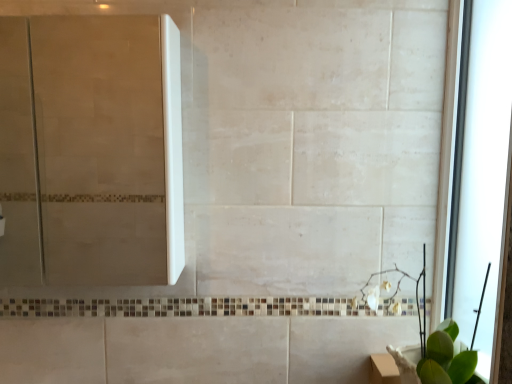
Question: From a real-world perspective, is green leafy plant at lower right positioned under transparent glass window at right based on gravity?

Choices:
 (A) no
 (B) yes

Answer: (B)

Question: Is the position of green leafy plant at lower right more distant than that of transparent glass window at right?

Choices:
 (A) yes
 (B) no

Answer: (B)

Question: Is green leafy plant at lower right not within transparent glass window at right?

Choices:
 (A) no
 (B) yes

Answer: (B)

Question: Can you confirm if green leafy plant at lower right is smaller than transparent glass window at right?

Choices:
 (A) no
 (B) yes

Answer: (A)

Question: Could transparent glass window at right be considered to be inside green leafy plant at lower right?

Choices:
 (A) no
 (B) yes

Answer: (A)

Question: Can you confirm if green leafy plant at lower right is shorter than transparent glass window at right?

Choices:
 (A) yes
 (B) no

Answer: (A)

Question: Is transparent glass window at right turned away from green leafy plant at lower right?

Choices:
 (A) no
 (B) yes

Answer: (A)

Question: Can you confirm if transparent glass window at right is thinner than green leafy plant at lower right?

Choices:
 (A) no
 (B) yes

Answer: (B)

Question: From a real-world perspective, is transparent glass window at right under green leafy plant at lower right?

Choices:
 (A) yes
 (B) no

Answer: (B)

Question: Could you tell me if transparent glass window at right is turned towards green leafy plant at lower right?

Choices:
 (A) no
 (B) yes

Answer: (B)

Question: Considering the relative sizes of transparent glass window at right and green leafy plant at lower right in the image provided, is transparent glass window at right shorter than green leafy plant at lower right?

Choices:
 (A) no
 (B) yes

Answer: (A)

Question: Is transparent glass window at right not near green leafy plant at lower right?

Choices:
 (A) yes
 (B) no

Answer: (B)

Question: Is white glossy screen door at upper left thinner than green leafy plant at lower right?

Choices:
 (A) no
 (B) yes

Answer: (B)